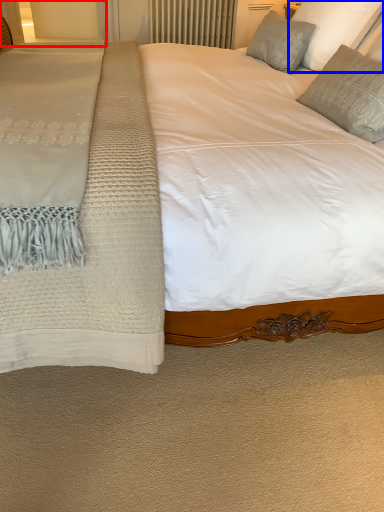
Question: Which object is closer to the camera taking this photo, glass door (highlighted by a red box) or pillow (highlighted by a blue box)?

Choices:
 (A) glass door
 (B) pillow

Answer: (B)